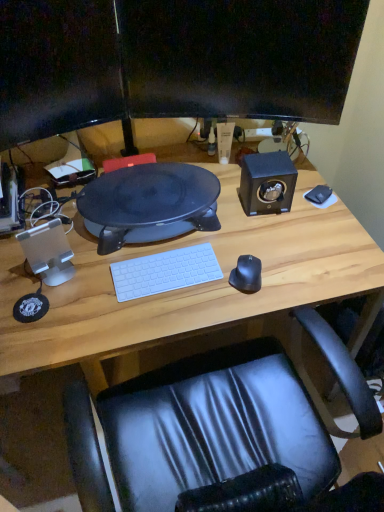
I want to click on vacant area that is in front of black matte mouse at right, so click(x=243, y=307).